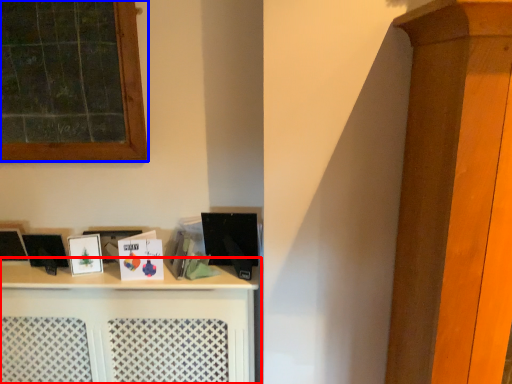
Question: Among these objects, which one is nearest to the camera, shelf (highlighted by a red box) or window (highlighted by a blue box)?

Choices:
 (A) shelf
 (B) window

Answer: (B)